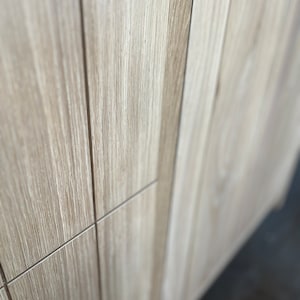
Find the location of a particular element. light wood grain is located at coordinates (86, 153), (86, 164).